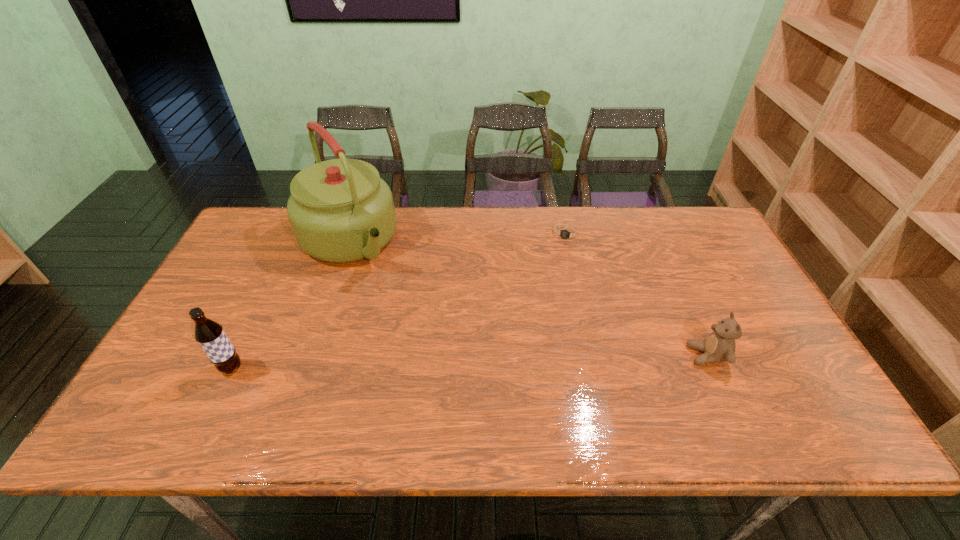
Identify the location of vacant spot on the desktop that is between the root beer and the rightmost object and is positioned at the spout of the tallest object. This screenshot has height=540, width=960. (447, 362).

Where is `free space on the desktop that is between the root beer and the teddy bear and is positioned on the face of the watch`? This screenshot has width=960, height=540. free space on the desktop that is between the root beer and the teddy bear and is positioned on the face of the watch is located at coordinates (518, 360).